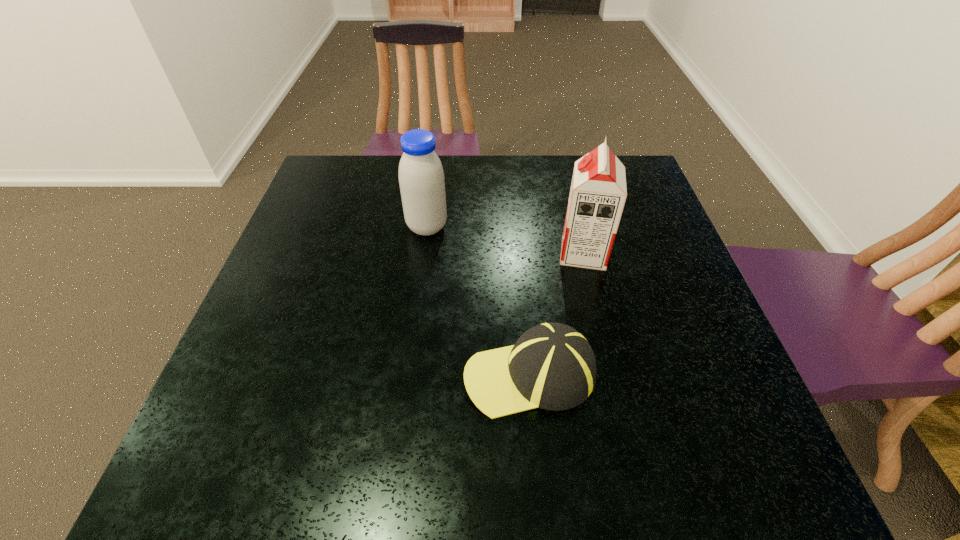
Image resolution: width=960 pixels, height=540 pixels. In order to click on vacant area that satisfies the following two spatial constraints: 1. on the front side of the left soya milk; 2. on the left side of the right soya milk in this screenshot , I will do `click(423, 253)`.